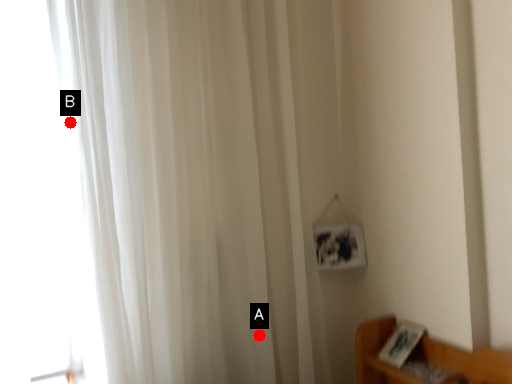
Question: Two points are circled on the image, labeled by A and B beside each circle. Which point appears farthest from the camera in this image?

Choices:
 (A) A is further
 (B) B is further

Answer: (A)